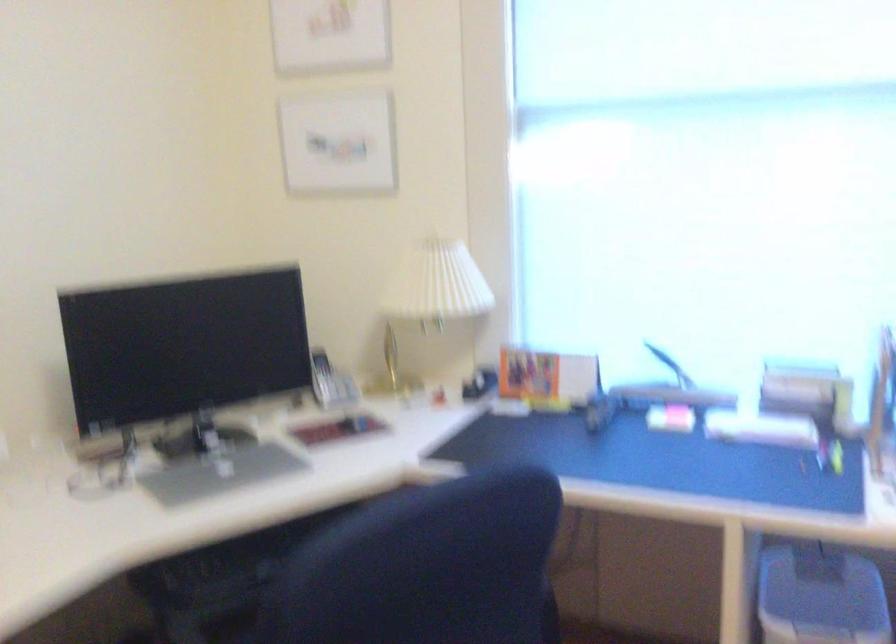
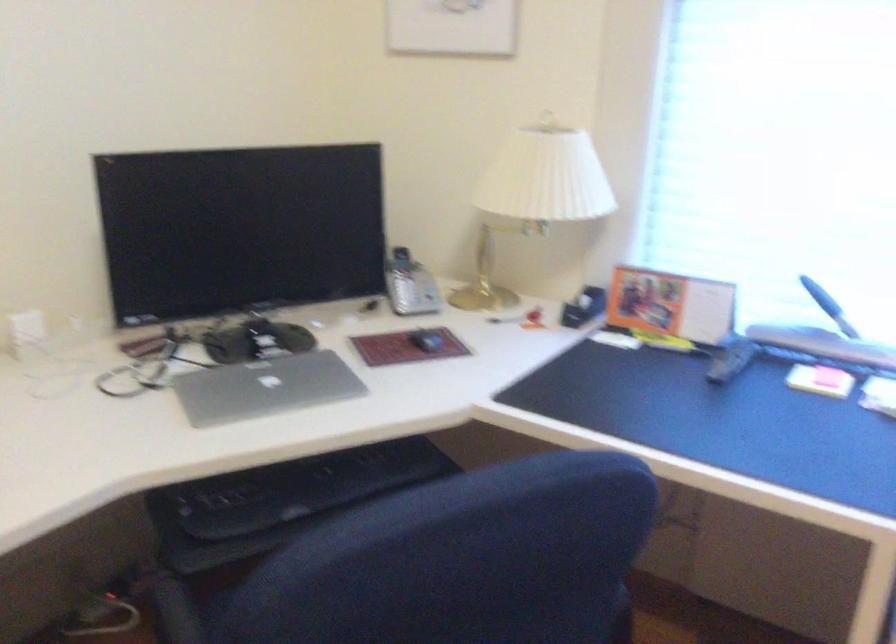
The point at (416,402) is marked in the first image. Where is the corresponding point in the second image?

(504, 319)